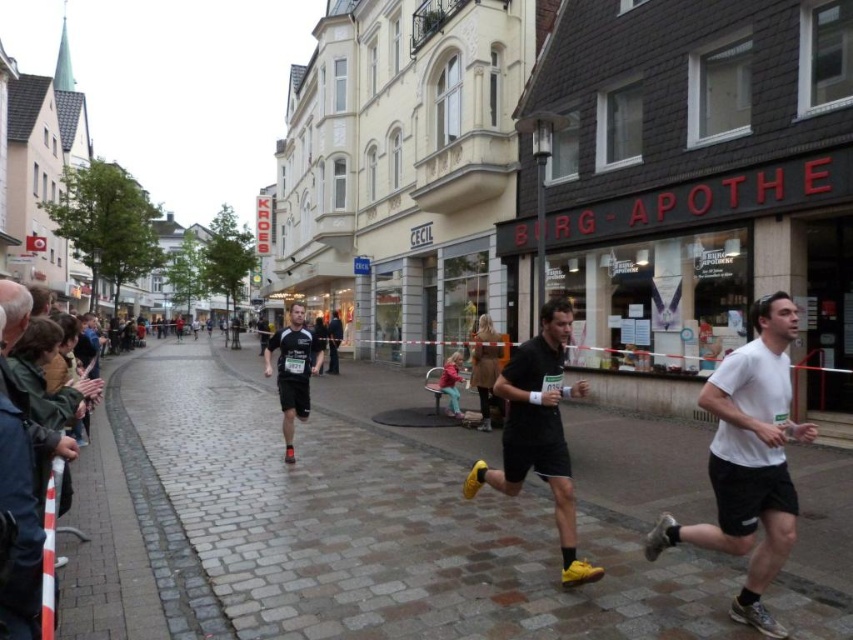
Is dark blue jacket at left further to camera compared to black matte running shoe at center?

No, dark blue jacket at left is closer to the viewer.

Is dark blue jacket at left wider than black matte running shoe at center?

In fact, dark blue jacket at left might be narrower than black matte running shoe at center.

Is point (13, 477) closer to viewer compared to point (305, 416)?

Yes, point (13, 477) is closer to viewer.

I want to click on dark blue jacket at left, so click(18, 480).

Does point (751, 436) come behind point (540, 321)?

No, (751, 436) is in front of (540, 321).

Who is more forward, (785, 493) or (521, 355)?

Point (785, 493)

Which is in front, point (653, 525) or point (502, 435)?

Point (653, 525)

Image resolution: width=853 pixels, height=640 pixels. In order to click on white matte shirt at right in this screenshot , I will do pos(749,461).

Does point (294, 412) come closer to viewer compared to point (328, 333)?

That is True.

Can you confirm if black matte running shoe at center is taller than black running shorts at center?

Correct, black matte running shoe at center is much taller as black running shorts at center.

Does point (286, 362) come closer to viewer compared to point (328, 339)?

Yes, it is in front of point (328, 339).

The image size is (853, 640). In order to click on black matte running shoe at center in this screenshot , I will do `click(293, 371)`.